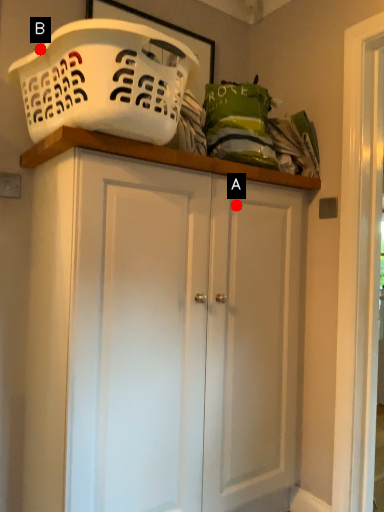
Question: Two points are circled on the image, labeled by A and B beside each circle. Which point is closer to the camera taking this photo?

Choices:
 (A) A is closer
 (B) B is closer

Answer: (B)